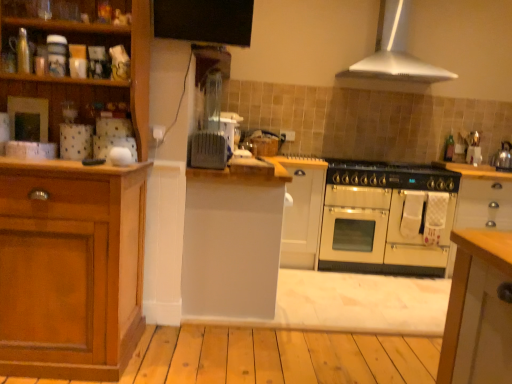
Question: Is cream matte oven at center in front of or behind metallic silver kettle at right in the image?

Choices:
 (A) front
 (B) behind

Answer: (A)

Question: Is point (372, 226) closer or farther from the camera than point (499, 162)?

Choices:
 (A) closer
 (B) farther

Answer: (A)

Question: Which is nearer to the matte black gas stove at center?

Choices:
 (A) white glossy oven at center-right, the first cabinetry viewed from the right
 (B) slate gray toaster at center, which appears as the 1th appliance when viewed from the front
 (C) wooden cabinet at left, the first cabinetry viewed from the left
 (D) metallic silver kettle at right
 (E) green glass bottle at upper right

Answer: (A)

Question: Which of these objects is positioned farthest from the white matte cabinet at center, the second cabinetry positioned from the left?

Choices:
 (A) white matte cabinet at center, positioned as the 2th cabinetry in right-to-left order
 (B) green glass bottle at upper right
 (C) cream matte oven at center
 (D) white glossy oven at center-right, the first cabinetry viewed from the right
 (E) white metallic range hood at upper center

Answer: (B)